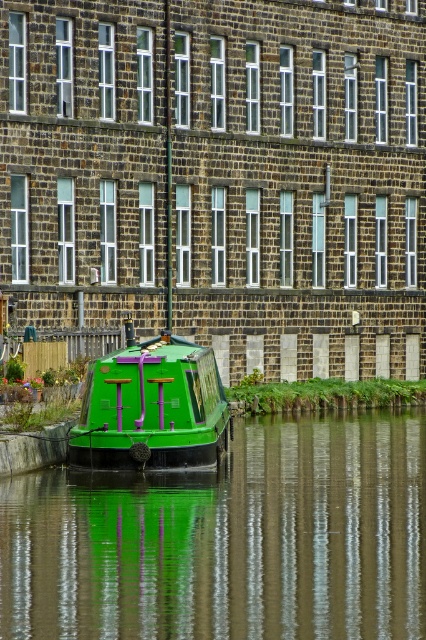
Question: Among these objects, which one is farthest from the camera?

Choices:
 (A) green matte boat at center
 (B) green glossy boat at lower left

Answer: (A)

Question: Which point is farther to the camera?

Choices:
 (A) green matte boat at center
 (B) green glossy boat at lower left

Answer: (A)

Question: Which point is farther to the camera?

Choices:
 (A) green matte boat at center
 (B) green glossy boat at lower left

Answer: (A)

Question: Does green glossy boat at lower left have a larger size compared to green matte boat at center?

Choices:
 (A) yes
 (B) no

Answer: (B)

Question: Is green glossy boat at lower left closer to camera compared to green matte boat at center?

Choices:
 (A) no
 (B) yes

Answer: (B)

Question: Where is green glossy boat at lower left located in relation to green matte boat at center in the image?

Choices:
 (A) left
 (B) right

Answer: (B)